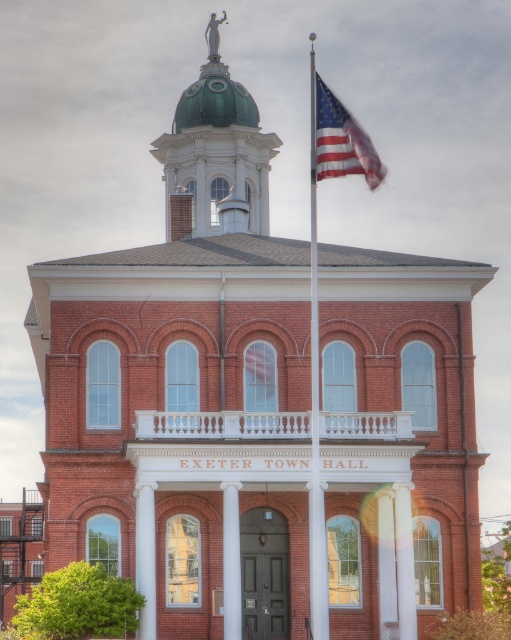
Question: Is metallic silver flag pole at center positioned before american flag at upper right?

Choices:
 (A) no
 (B) yes

Answer: (A)

Question: Is metallic silver flag pole at center closer to the viewer compared to american flag at upper right?

Choices:
 (A) no
 (B) yes

Answer: (A)

Question: Which of the following is the farthest from the observer?

Choices:
 (A) american flag at upper right
 (B) metallic silver flag pole at center

Answer: (B)

Question: Does metallic silver flag pole at center have a larger size compared to american flag at upper right?

Choices:
 (A) no
 (B) yes

Answer: (B)

Question: Among these objects, which one is nearest to the camera?

Choices:
 (A) metallic silver flag pole at center
 (B) american flag at upper right

Answer: (B)